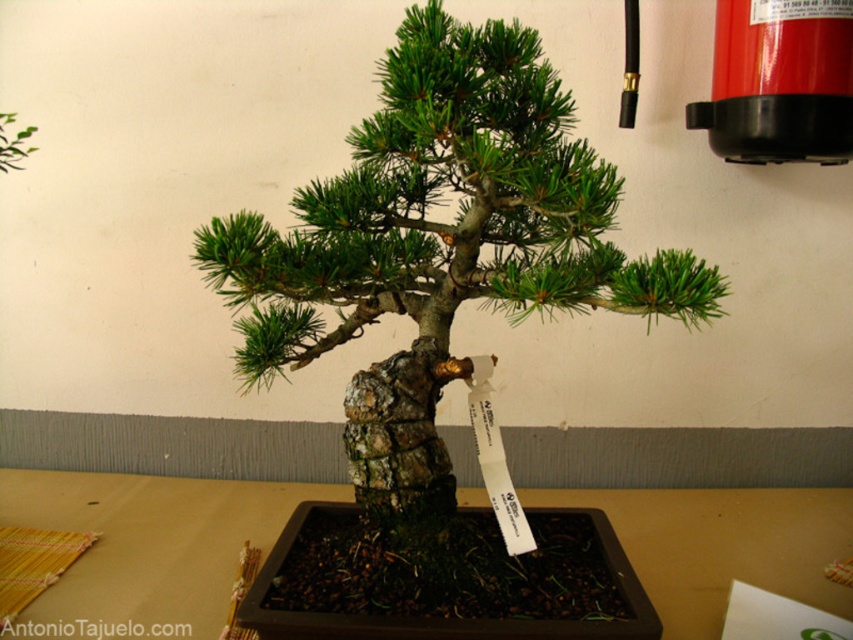
Question: Among these points, which one is farthest from the camera?

Choices:
 (A) (271, 518)
 (B) (709, 275)

Answer: (A)

Question: Which point is farther from the camera taking this photo?

Choices:
 (A) (405, 388)
 (B) (27, 616)

Answer: (B)

Question: Can you confirm if green textured bonsai at center is positioned below brown wooden table at center?

Choices:
 (A) yes
 (B) no

Answer: (B)

Question: In this image, where is green textured bonsai at center located relative to brown wooden table at center?

Choices:
 (A) right
 (B) left

Answer: (A)

Question: Does green textured bonsai at center have a lesser width compared to brown wooden table at center?

Choices:
 (A) no
 (B) yes

Answer: (B)

Question: Which of the following is the closest to the observer?

Choices:
 (A) brown wooden table at center
 (B) green textured bonsai at center

Answer: (B)